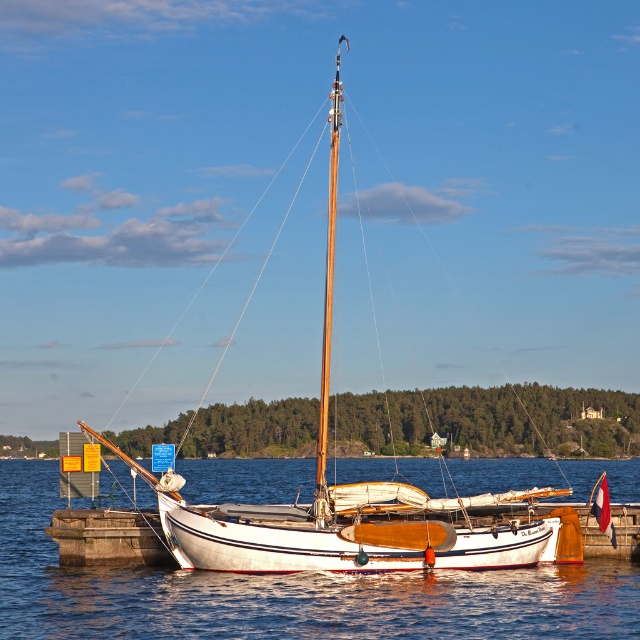
Does white smooth water at center have a lesser height compared to white wood sailboat at center?

Yes, white smooth water at center is shorter than white wood sailboat at center.

Does white smooth water at center have a greater height compared to white wood sailboat at center?

No.

Does point (248, 468) come farther from viewer compared to point (316, 548)?

Yes, it is.

Where is `white smooth water at center`? white smooth water at center is located at coordinates (285, 593).